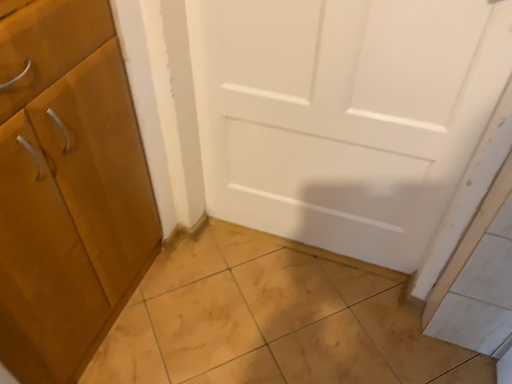
Question: Looking at their shapes, would you say matte wood cabinet at left is wider or thinner than light brown tile at lower left?

Choices:
 (A) wide
 (B) thin

Answer: (B)

Question: From a real-world perspective, is matte wood cabinet at left physically located above or below light brown tile at lower left?

Choices:
 (A) above
 (B) below

Answer: (A)

Question: From the image's perspective, is matte wood cabinet at left above or below light brown tile at lower left?

Choices:
 (A) above
 (B) below

Answer: (A)

Question: Considering their positions, is light brown tile at lower left located in front of or behind matte wood cabinet at left?

Choices:
 (A) front
 (B) behind

Answer: (B)

Question: In terms of width, does light brown tile at lower left look wider or thinner when compared to matte wood cabinet at left?

Choices:
 (A) wide
 (B) thin

Answer: (A)

Question: Is point (359, 299) positioned closer to the camera than point (1, 190)?

Choices:
 (A) closer
 (B) farther

Answer: (B)

Question: Looking at the image, does light brown tile at lower left seem bigger or smaller compared to matte wood cabinet at left?

Choices:
 (A) small
 (B) big

Answer: (A)